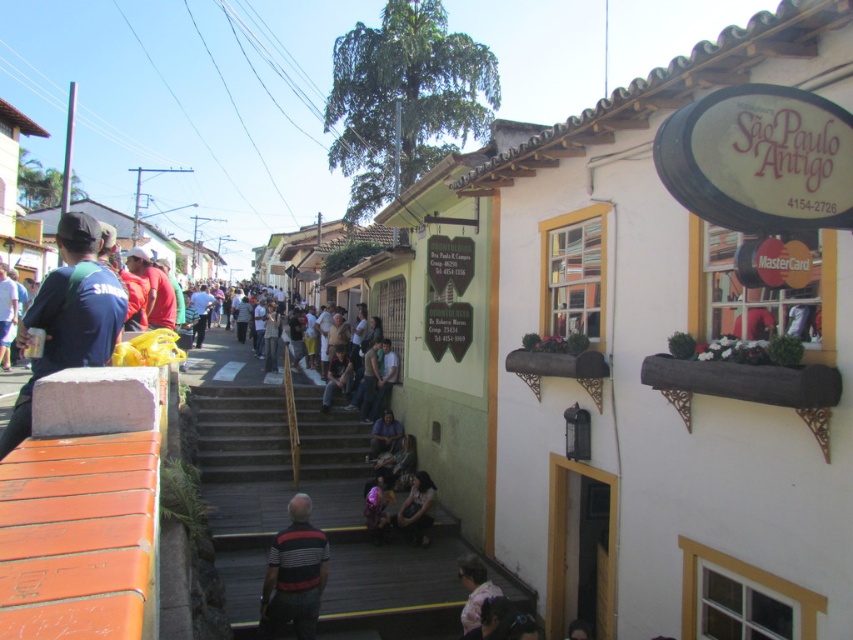
Question: Does dark brown leather jacket at center appear on the right side of pink fabric at center?

Choices:
 (A) yes
 (B) no

Answer: (A)

Question: Observing the image, what is the correct spatial positioning of wooden stairs at center in reference to striped cotton shirt at center?

Choices:
 (A) above
 (B) below

Answer: (B)

Question: Estimate the real-world distances between objects in this image. Which object is farther from the dark blue jeans at center?

Choices:
 (A) wooden stairs at center
 (B) white concrete stairs at center

Answer: (A)

Question: Does striped cotton shirt at center appear over pink fabric at center?

Choices:
 (A) yes
 (B) no

Answer: (A)

Question: Which point appears farthest from the camera in this image?

Choices:
 (A) (285, 552)
 (B) (28, 419)
 (C) (440, 604)

Answer: (C)

Question: Which of the following is the farthest from the observer?

Choices:
 (A) (300, 572)
 (B) (496, 579)
 (C) (64, 278)
 (D) (434, 486)

Answer: (D)